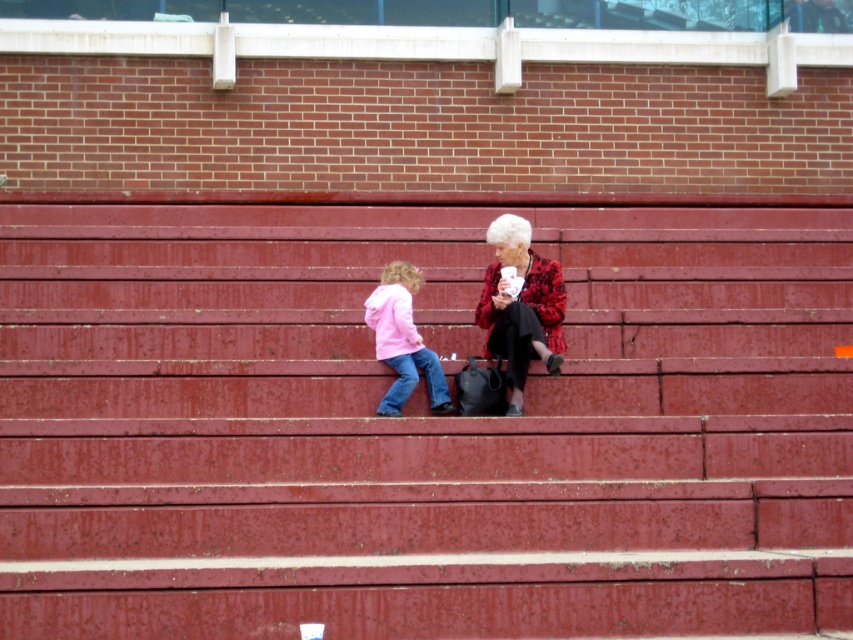
Question: Is smooth red stairs at center to the left of matte pink jacket at lower left from the viewer's perspective?

Choices:
 (A) no
 (B) yes

Answer: (B)

Question: Which of the following is the closest to the observer?

Choices:
 (A) (294, 225)
 (B) (395, 312)
 (C) (508, 404)

Answer: (C)

Question: Where is red plaid jacket at center located in relation to matte pink jacket at lower left in the image?

Choices:
 (A) above
 (B) below

Answer: (A)

Question: Is red plaid jacket at center below matte pink jacket at lower left?

Choices:
 (A) no
 (B) yes

Answer: (A)

Question: Which is nearer to the matte pink jacket at lower left?

Choices:
 (A) red plaid jacket at center
 (B) smooth red stairs at center

Answer: (A)

Question: Which object appears closest to the camera in this image?

Choices:
 (A) red plaid jacket at center
 (B) matte pink jacket at lower left

Answer: (A)